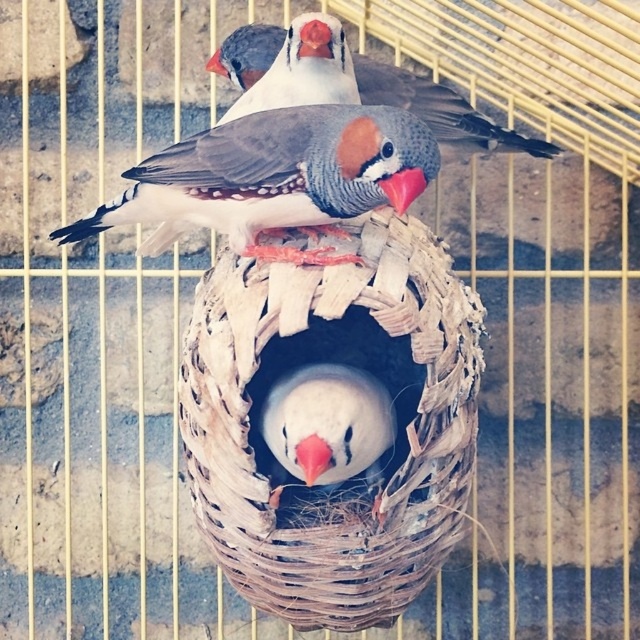
Question: Among these objects, which one is nearest to the camera?

Choices:
 (A) speckled feathered bird at center
 (B) woven straw nest at center
 (C) white matte bird at center

Answer: (C)

Question: Can you confirm if speckled feathered bird at center is positioned above speckled feathered bird at upper center?

Choices:
 (A) yes
 (B) no

Answer: (B)

Question: Can you confirm if white matte bird at center is thinner than speckled feathered bird at upper center?

Choices:
 (A) no
 (B) yes

Answer: (B)

Question: Among these points, which one is nearest to the camera?

Choices:
 (A) (440, 125)
 (B) (316, 440)

Answer: (B)

Question: Which of the following is the closest to the observer?

Choices:
 (A) speckled feathered bird at upper center
 (B) speckled feathered bird at center
 (C) white matte bird at center

Answer: (C)

Question: Is woven straw nest at center smaller than speckled feathered bird at center?

Choices:
 (A) yes
 (B) no

Answer: (B)